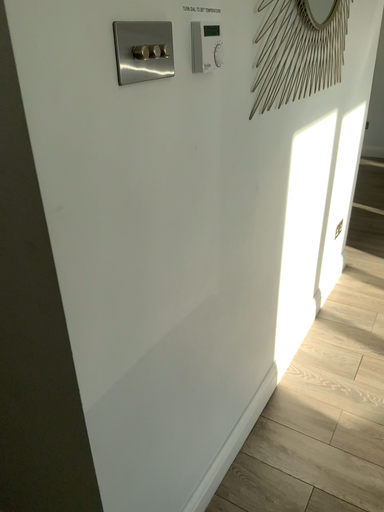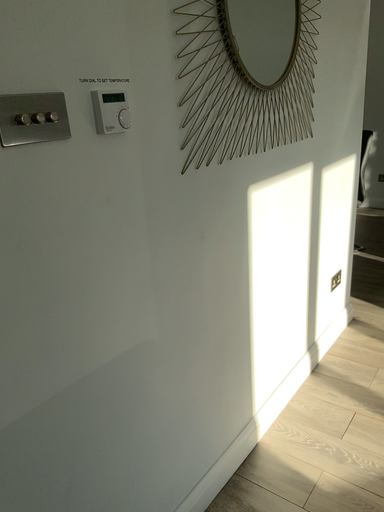
Question: How did the camera likely rotate when shooting the video?

Choices:
 (A) rotated left
 (B) rotated right

Answer: (A)